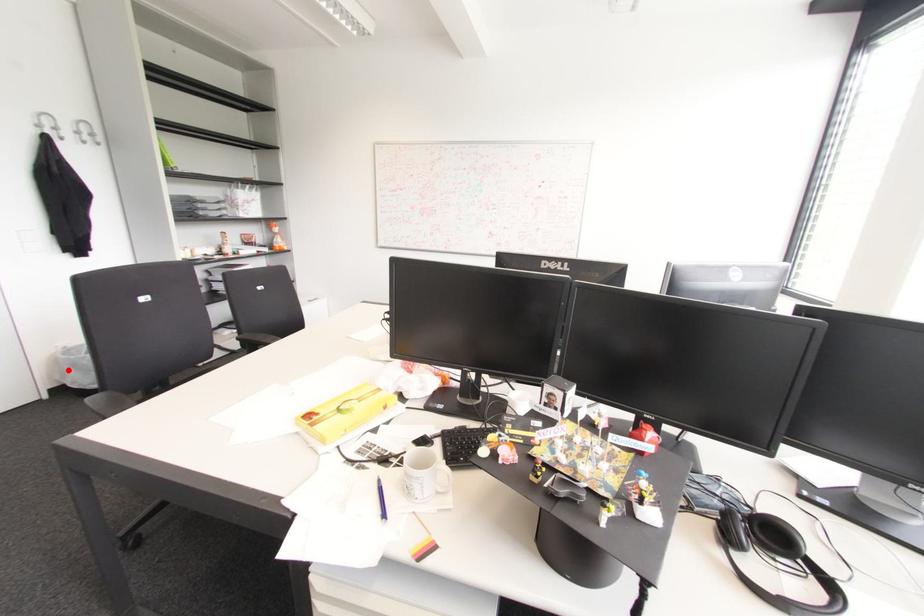
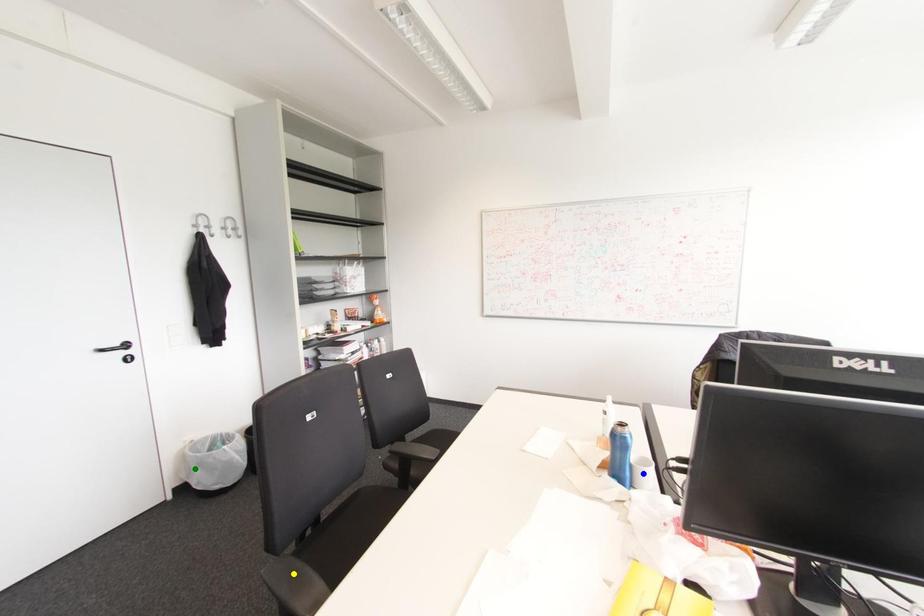
Question: I am providing you with two images of the same scene from different viewpoints. A red point is marked on the first image. You are given multiple points on the second image. Which spot in image 2 lines up with the point in image 1?

Choices:
 (A) blue point
 (B) yellow point
 (C) green point

Answer: (C)